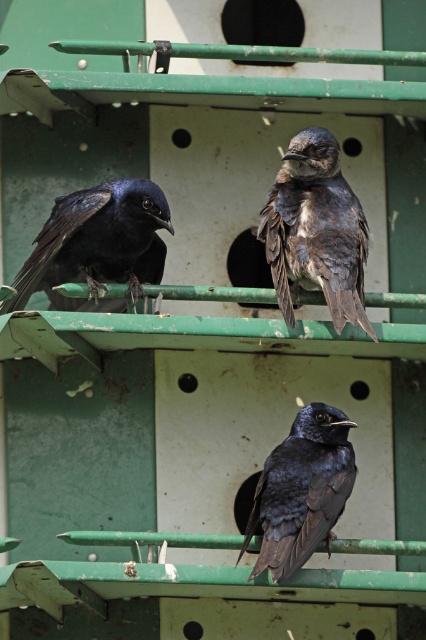
Which is behind, point (365, 260) or point (121, 227)?

The point (121, 227) is more distant.

Is point (313, 256) more distant than point (88, 202)?

Yes, it is behind point (88, 202).

Image resolution: width=426 pixels, height=640 pixels. What are the coordinates of `shiny dark blue bird at center` in the screenshot? It's located at (316, 228).

Where is `matte black bird at upper left`? This screenshot has height=640, width=426. matte black bird at upper left is located at coordinates (97, 243).

Describe the element at coordinates (97, 243) in the screenshot. The image size is (426, 640). I see `matte black bird at upper left` at that location.

Locate an element on the screen. The image size is (426, 640). matte black bird at upper left is located at coordinates (97, 243).

How far apart are shiny dark blue bird at center and shiny black bird at center?

shiny dark blue bird at center is 15.47 inches away from shiny black bird at center.

Does shiny dark blue bird at center appear on the left side of shiny black bird at center?

In fact, shiny dark blue bird at center is to the right of shiny black bird at center.

The height and width of the screenshot is (640, 426). I want to click on shiny dark blue bird at center, so click(316, 228).